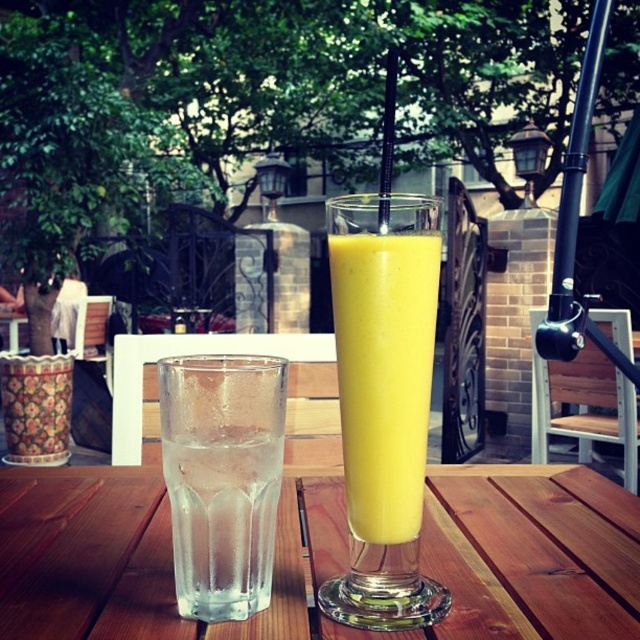
Can you confirm if transparent glass at center is taller than yellow smoothie at center?

No, transparent glass at center is not taller than yellow smoothie at center.

The height and width of the screenshot is (640, 640). Describe the element at coordinates (529, 554) in the screenshot. I see `transparent glass at center` at that location.

Who is more forward, (484, 605) or (380, 344)?

Positioned in front is point (380, 344).

Identify the location of transparent glass at center. Image resolution: width=640 pixels, height=640 pixels. 529,554.

Who is lower down, clear glass at left or yellow smoothie at center?

Positioned lower is clear glass at left.

Is point (228, 410) behind point (381, 308)?

No, it is in front of (381, 308).

What are the coordinates of `clear glass at left` in the screenshot? It's located at (221, 477).

Does transparent glass at center have a smaller size compared to clear glass at left?

Incorrect, transparent glass at center is not smaller in size than clear glass at left.

Is transparent glass at center closer to the viewer compared to clear glass at left?

No.

Is point (106, 624) less distant than point (218, 445)?

No.

Where is `transparent glass at center`? The height and width of the screenshot is (640, 640). transparent glass at center is located at coordinates (529, 554).